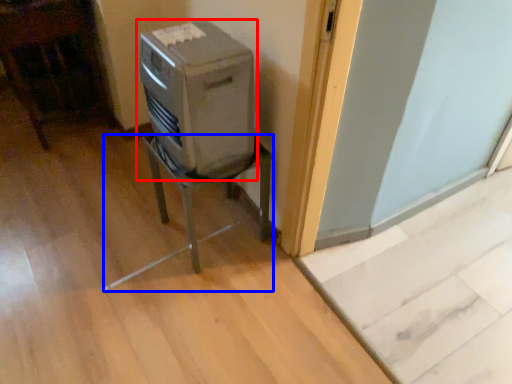
Question: Among these objects, which one is farthest to the camera, home appliance (highlighted by a red box) or furniture (highlighted by a blue box)?

Choices:
 (A) home appliance
 (B) furniture

Answer: (B)